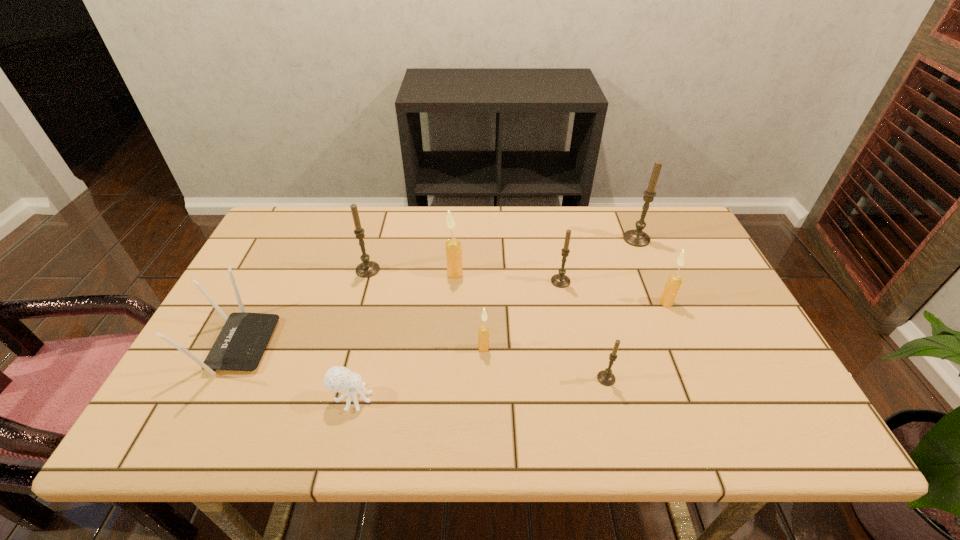
Locate an element on the screen. the leftmost object is located at coordinates (240, 345).

Identify the location of the nearest candle. This screenshot has height=540, width=960. (605, 377).

Locate an element on the screen. The height and width of the screenshot is (540, 960). the nearest gray candle is located at coordinates (605, 377).

Where is `the third candle from left to right`? The width and height of the screenshot is (960, 540). the third candle from left to right is located at coordinates [x=483, y=333].

This screenshot has height=540, width=960. Find the location of `the nearest cream candle`. the nearest cream candle is located at coordinates (483, 333).

Where is `white octopus`? white octopus is located at coordinates (337, 379).

Where is `the shortest object`? This screenshot has height=540, width=960. the shortest object is located at coordinates (337, 379).

The image size is (960, 540). I want to click on free space located 0.270m on the left of the farthest object, so click(537, 239).

The image size is (960, 540). Find the location of `vacant space situated 0.230m on the left of the sixth object from right to left`. vacant space situated 0.230m on the left of the sixth object from right to left is located at coordinates (366, 274).

Find the location of a particular element. blank area located 0.080m on the left of the third smallest gray candle is located at coordinates (328, 270).